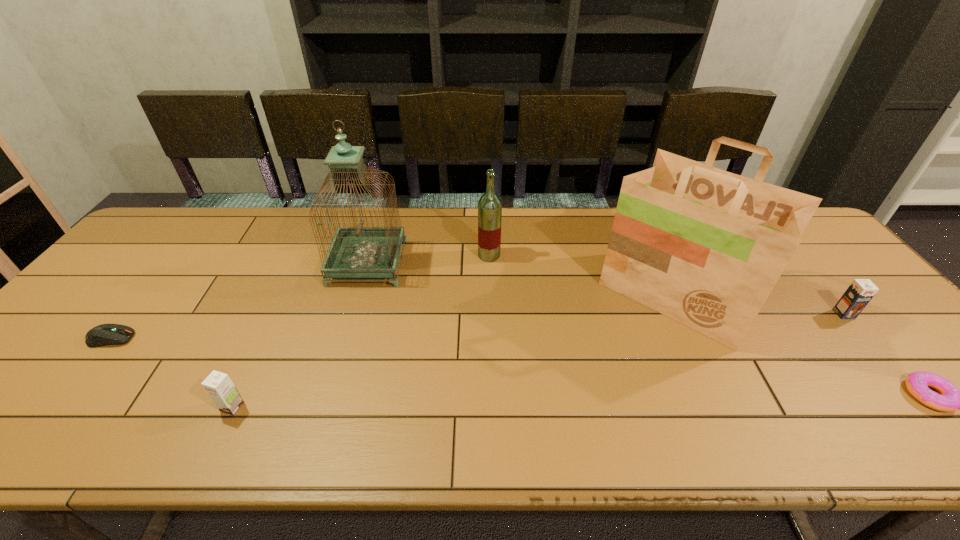
Identify which object is the fourth nearest to the fourth object from left to right. Please provide its 2D coordinates. Your answer should be formatted as a tuple, i.e. [(x, y)], where the tuple contains the x and y coordinates of a point satisfying the conditions above.

[(105, 334)]

The width and height of the screenshot is (960, 540). In order to click on the fourth closest object to the grocery bag in this screenshot , I will do `click(355, 252)`.

The height and width of the screenshot is (540, 960). What are the coordinates of `free location that satisfies the following two spatial constraints: 1. on the button of the leftmost object; 2. on the right side of the second object from left to right` in the screenshot? It's located at (57, 407).

Locate an element on the screen. This screenshot has height=540, width=960. vacant region that satisfies the following two spatial constraints: 1. at the door of the birdcage; 2. on the front side of the second object from left to right is located at coordinates (325, 407).